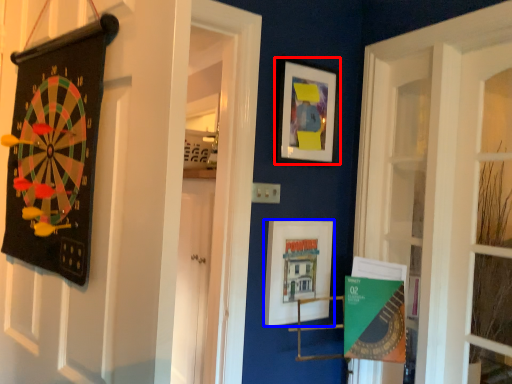
Question: Which of the following is the farthest to the observer, picture frame (highlighted by a red box) or picture frame (highlighted by a blue box)?

Choices:
 (A) picture frame
 (B) picture frame

Answer: (A)